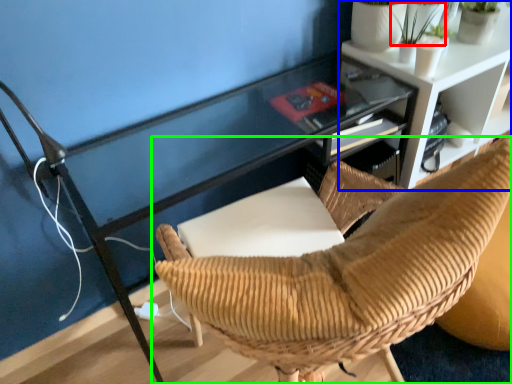
Question: Which object is positioned farthest from plant (highlighted by a red box)? Select from shelf (highlighted by a blue box) and chair (highlighted by a green box).

Choices:
 (A) shelf
 (B) chair

Answer: (B)